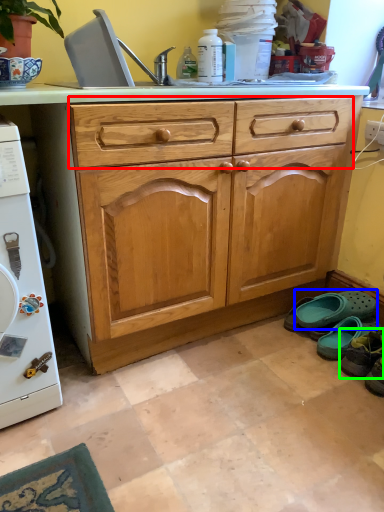
Question: Which object is the closest to the drawer (highlighted by a red box)? Choose among these: footwear (highlighted by a blue box) or footwear (highlighted by a green box).

Choices:
 (A) footwear
 (B) footwear

Answer: (A)